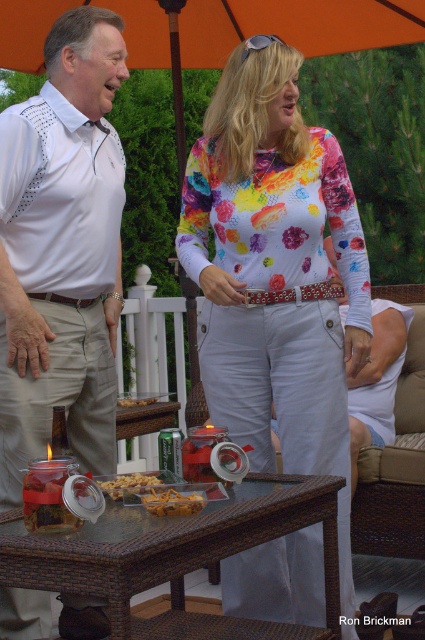
What are the coordinates of the floral print blouse at center?

The floral print blouse at center is located at coordinates point (275, 275).

You are a photographer at the gathering and want to take a photo focusing on the floral print blouse at center and the golden crispy chips at center. Which object should you adjust your camera to focus on first if you want to capture the one that is more to the left?

The golden crispy chips at center should be focused on first because the floral print blouse at center is positioned on the right side of the golden crispy chips at center, making the chips more to the left.